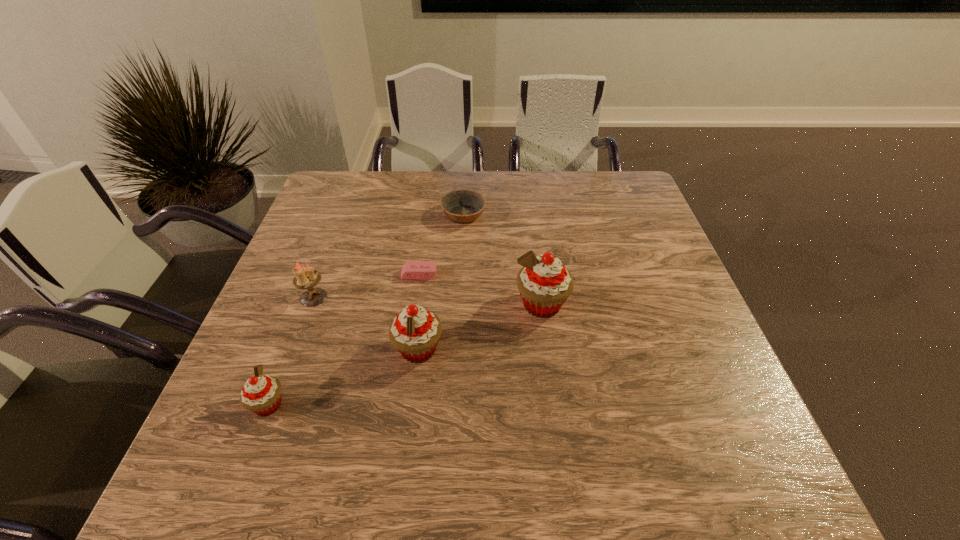
Where is `the fourth shortest object`? The width and height of the screenshot is (960, 540). the fourth shortest object is located at coordinates (305, 277).

This screenshot has width=960, height=540. Find the location of `free space located on the right of the leftmost cupcake`. free space located on the right of the leftmost cupcake is located at coordinates [x=399, y=404].

This screenshot has height=540, width=960. Find the location of `vacant space located on the back of the second tallest object`. vacant space located on the back of the second tallest object is located at coordinates pyautogui.click(x=428, y=272).

Where is `free location located 0.060m on the left of the rightmost cupcake`? This screenshot has height=540, width=960. free location located 0.060m on the left of the rightmost cupcake is located at coordinates (489, 305).

At what (x,y) coordinates should I click in order to perform the action: click on free space located on the back of the bowl. Please return your answer as a coordinate pair (x, y). Looking at the image, I should click on (465, 184).

Locate an element on the screen. This screenshot has height=540, width=960. vacant space located on the back of the eraser is located at coordinates (431, 193).

Where is `free space located 0.110m on the front of the fourth shortest object`? The height and width of the screenshot is (540, 960). free space located 0.110m on the front of the fourth shortest object is located at coordinates (296, 344).

Identify the location of object at the far edge. This screenshot has height=540, width=960. (461, 206).

Locate an element on the screen. object located at the near edge is located at coordinates (261, 394).

This screenshot has width=960, height=540. I want to click on cupcake that is at the left edge, so click(x=261, y=394).